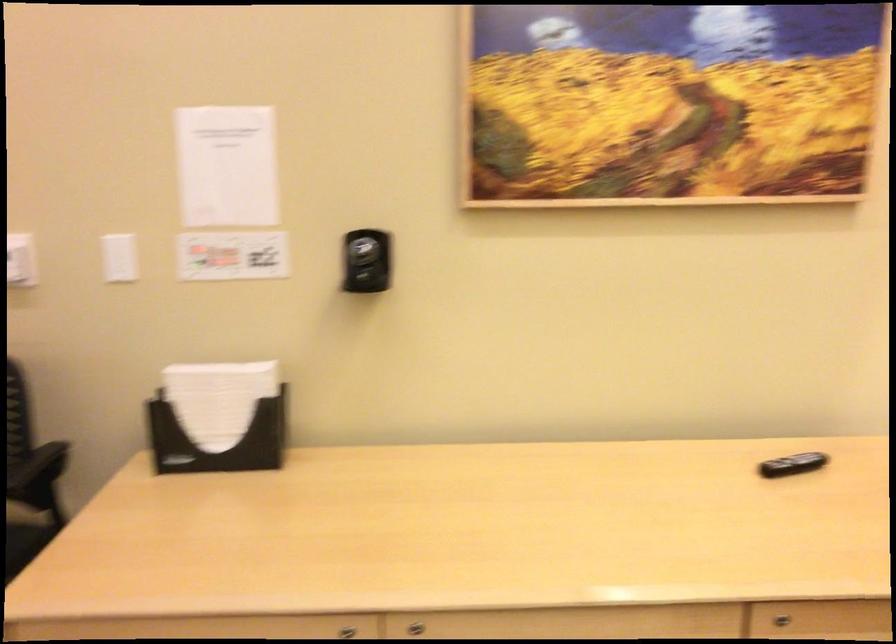
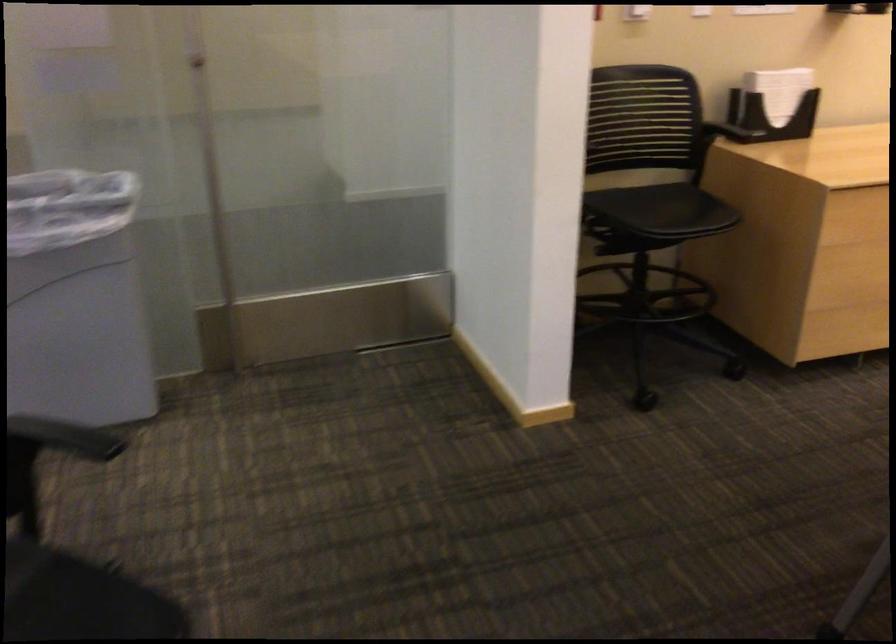
Question: What movement of the cameraman would produce the second image?

Choices:
 (A) Left
 (B) Right
 (C) Forward
 (D) Backward

Answer: (A)